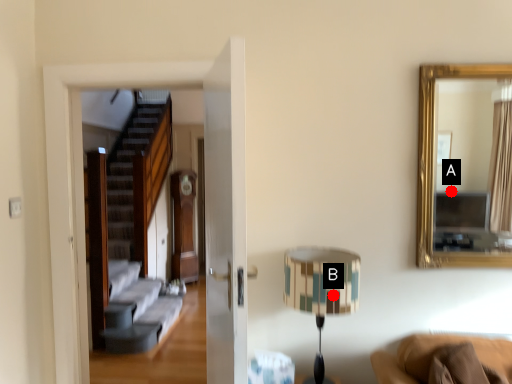
Question: Two points are circled on the image, labeled by A and B beside each circle. Which point is closer to the camera?

Choices:
 (A) A is closer
 (B) B is closer

Answer: (B)